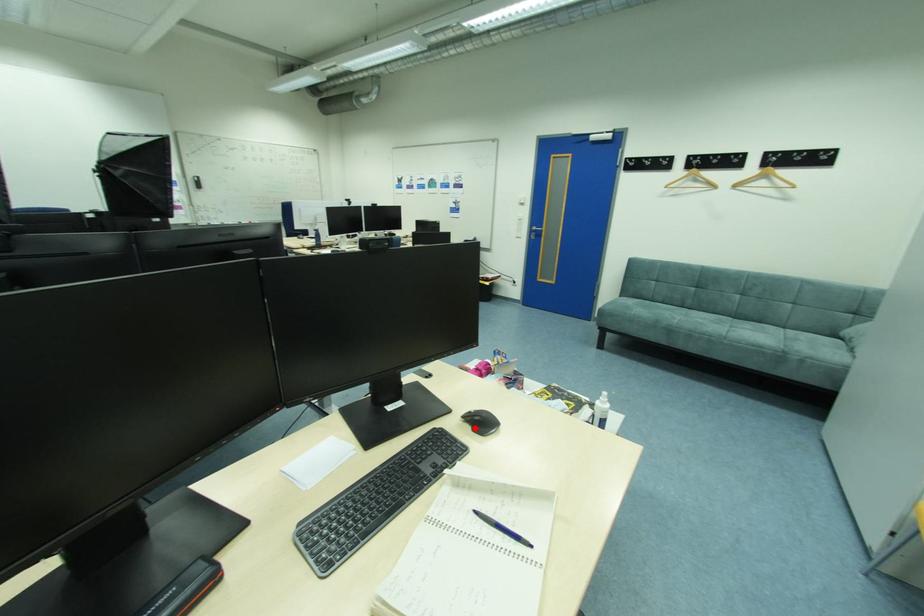
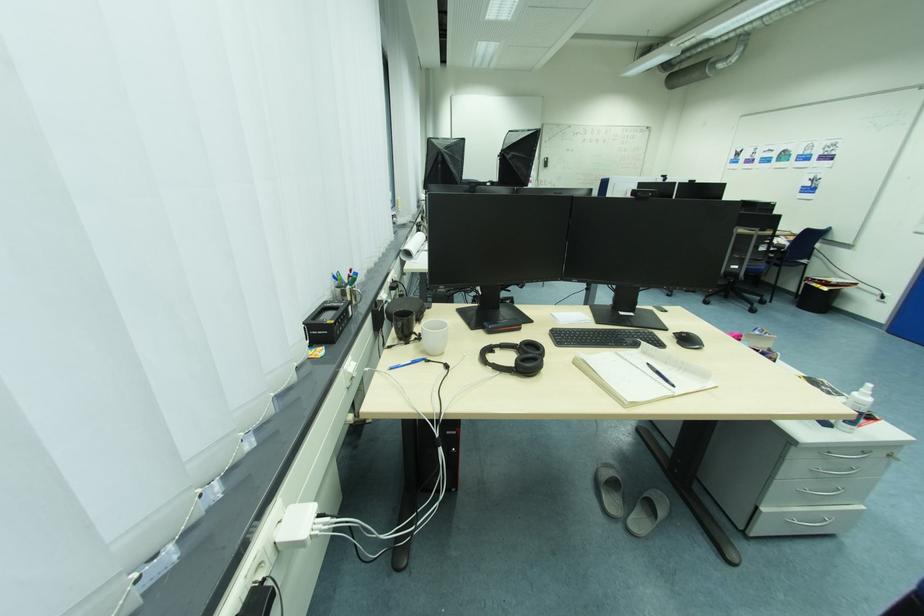
Find the pixel in the second image that matches the highlighted location in the first image.

(682, 341)